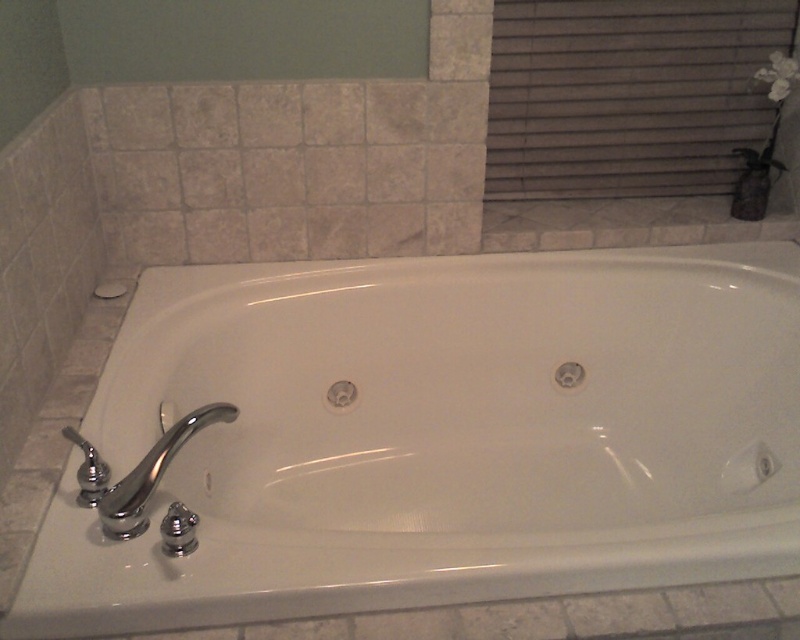
In the scene shown: Can you confirm if white glossy bathtub at center is thinner than chrome/metallic faucet at lower left?

Incorrect, white glossy bathtub at center's width is not less than chrome/metallic faucet at lower left's.

Does point (454, 508) lie behind point (170, 438)?

That is True.

The width and height of the screenshot is (800, 640). Identify the location of white glossy bathtub at center. coord(438,435).